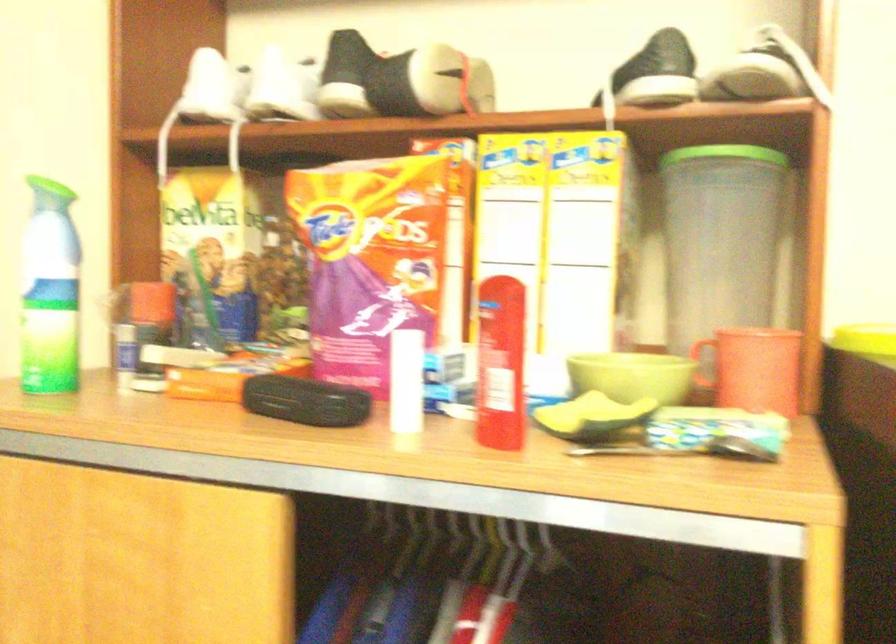
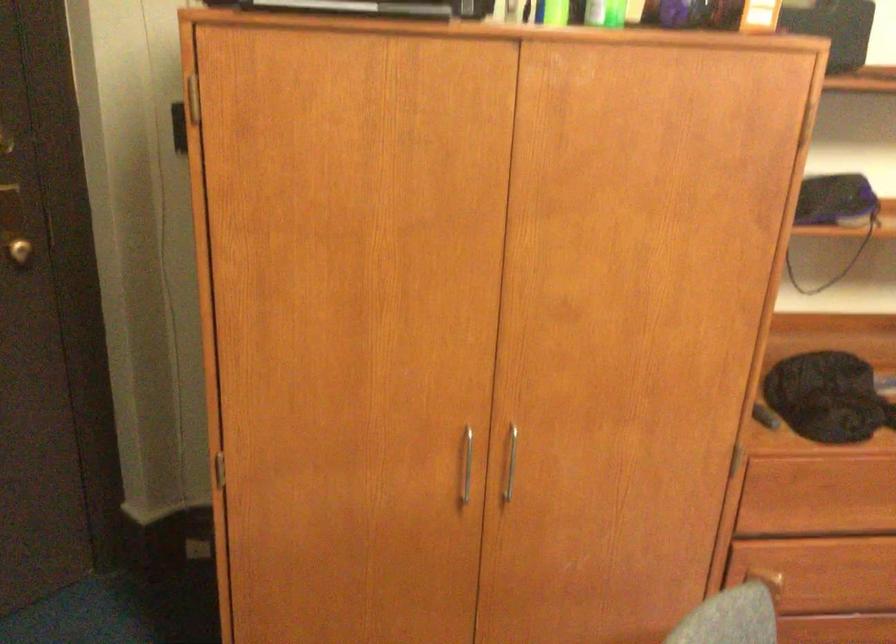
The images are taken continuously from a first-person perspective. In which direction is your viewpoint rotating?

The camera rotated toward right-down.